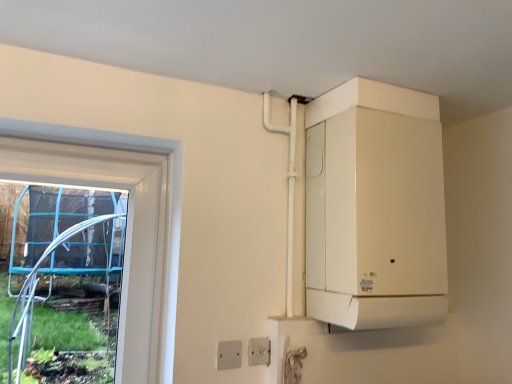
Question: Which direction should I rotate to face white plastic electric outlet at lower center, the 2th electric outlet positioned from the back, — up or down?

Choices:
 (A) down
 (B) up

Answer: (A)

Question: Could you tell me if white plastic electric outlet at lower center, marked as the 1th electric outlet in a back-to-front arrangement, is facing white matte boiler at upper right?

Choices:
 (A) yes
 (B) no

Answer: (B)

Question: From a real-world perspective, is white plastic electric outlet at lower center, which ranks as the second electric outlet in left-to-right order, located higher than white matte boiler at upper right?

Choices:
 (A) no
 (B) yes

Answer: (A)

Question: Does white plastic electric outlet at lower center, which ranks as the second electric outlet in left-to-right order, have a larger size compared to white matte boiler at upper right?

Choices:
 (A) no
 (B) yes

Answer: (A)

Question: Considering the relative positions of white plastic electric outlet at lower center, marked as the 1th electric outlet in a back-to-front arrangement, and white matte boiler at upper right in the image provided, is white plastic electric outlet at lower center, marked as the 1th electric outlet in a back-to-front arrangement, behind white matte boiler at upper right?

Choices:
 (A) yes
 (B) no

Answer: (A)

Question: From the image's perspective, is white plastic electric outlet at lower center, marked as the 1th electric outlet in a back-to-front arrangement, above white matte boiler at upper right?

Choices:
 (A) no
 (B) yes

Answer: (A)

Question: Considering the relative sizes of white plastic electric outlet at lower center, the 1th electric outlet from the right, and white matte boiler at upper right in the image provided, is white plastic electric outlet at lower center, the 1th electric outlet from the right, wider than white matte boiler at upper right?

Choices:
 (A) yes
 (B) no

Answer: (B)

Question: Does white plastic electric outlet at lower center, placed as the 2th electric outlet when sorted from front to back, have a greater height compared to white plastic electric outlet at lower center, the first electric outlet when ordered from front to back?

Choices:
 (A) yes
 (B) no

Answer: (B)

Question: Is white plastic electric outlet at lower center, the 2th electric outlet positioned from the back, completely or partially inside white plastic electric outlet at lower center, which ranks as the second electric outlet in left-to-right order?

Choices:
 (A) no
 (B) yes

Answer: (A)

Question: From the image's perspective, is white plastic electric outlet at lower center, which ranks as the second electric outlet in left-to-right order, above white plastic electric outlet at lower center, the 2th electric outlet positioned from the back?

Choices:
 (A) yes
 (B) no

Answer: (B)

Question: Can you see white plastic electric outlet at lower center, placed as the 2th electric outlet when sorted from front to back, touching white plastic electric outlet at lower center, the first electric outlet when ordered from front to back?

Choices:
 (A) no
 (B) yes

Answer: (B)

Question: Does white plastic electric outlet at lower center, the 1th electric outlet from the right, have a lesser height compared to white plastic electric outlet at lower center, the first electric outlet when ordered from front to back?

Choices:
 (A) yes
 (B) no

Answer: (A)

Question: Is white plastic electric outlet at lower center, the 1th electric outlet from the right, oriented towards white plastic electric outlet at lower center, the first electric outlet when ordered from front to back?

Choices:
 (A) yes
 (B) no

Answer: (B)

Question: Is white plastic electric outlet at lower center, the first electric outlet when ordered from front to back, taller than white matte boiler at upper right?

Choices:
 (A) no
 (B) yes

Answer: (A)